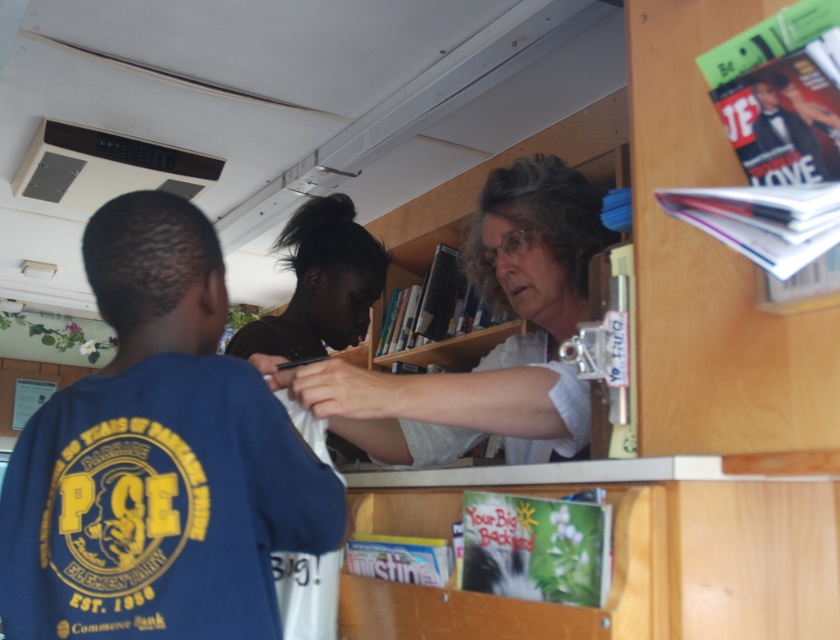
How much distance is there between matte paper magazine at upper right and blue glossy magazine at lower center?

They are 25.30 inches apart.

Is matte paper magazine at upper right thinner than blue glossy magazine at lower center?

No.

Is point (748, 202) positioned after point (381, 554)?

No, (748, 202) is closer to viewer.

Find the location of a particular element. matte paper magazine at upper right is located at coordinates [760, 220].

Between blue cotton shirt at center and green matte book at lower center, which one is positioned lower?

green matte book at lower center is below.

Is point (119, 250) closer to viewer compared to point (508, 576)?

That is False.

I want to click on blue cotton shirt at center, so click(156, 458).

Can you confirm if green matte book at lower center is bigger than matte paper magazine at upper right?

No.

Is green matte book at lower center to the left of matte paper magazine at upper right from the viewer's perspective?

Correct, you'll find green matte book at lower center to the left of matte paper magazine at upper right.

Is point (492, 516) positioned in front of point (667, 196)?

No, (492, 516) is behind (667, 196).

Locate an element on the screen. The image size is (840, 640). green matte book at lower center is located at coordinates (536, 547).